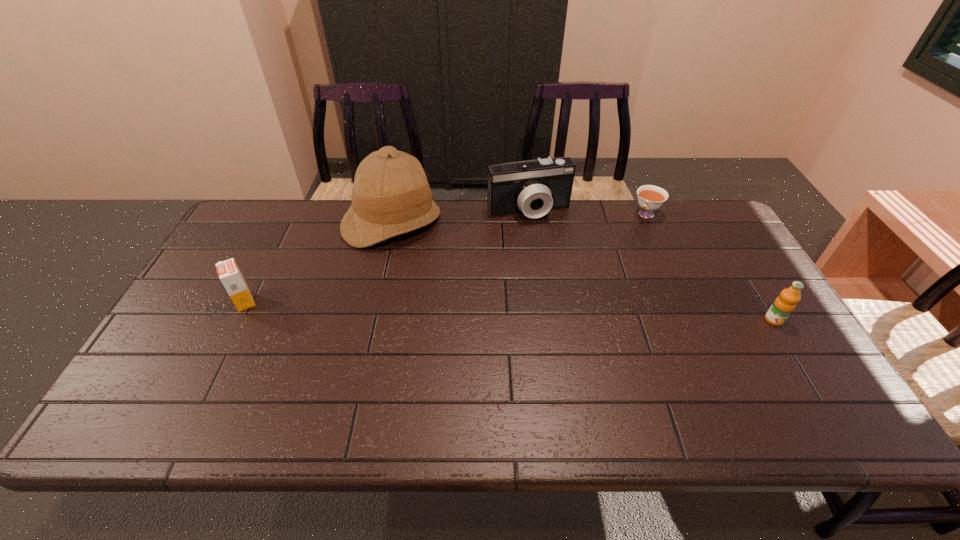
This screenshot has height=540, width=960. Find the location of `the left orange juice`. the left orange juice is located at coordinates (228, 271).

The image size is (960, 540). What are the coordinates of `the leftmost object` in the screenshot? It's located at (228, 271).

You are a GUI agent. You are given a task and a screenshot of the screen. Output one action in this format:
    pyautogui.click(x=<x>, y=<y>)
    Task: Click on the nearer orange juice
    This screenshot has height=540, width=960.
    Given the screenshot: What is the action you would take?
    pyautogui.click(x=784, y=304)

You are a GUI agent. You are given a task and a screenshot of the screen. Output one action in this format:
    pyautogui.click(x=<x>, y=<y>)
    Task: Click on the right orange juice
    This screenshot has height=540, width=960.
    Given the screenshot: What is the action you would take?
    (784, 304)

At what (x,y) coordinates should I click in order to perform the action: click on the shortest object. Please return your answer as a coordinate pair (x, y). Looking at the image, I should click on (650, 197).

Locate an element on the screen. The width and height of the screenshot is (960, 540). the fourth object from left to right is located at coordinates (650, 197).

Where is `the second tallest object`? the second tallest object is located at coordinates (533, 187).

Where is `camcorder`? This screenshot has width=960, height=540. camcorder is located at coordinates (533, 187).

Find the location of `hat`. hat is located at coordinates (391, 196).

Locate an element on the screen. This screenshot has height=540, width=960. the tallest object is located at coordinates (391, 196).